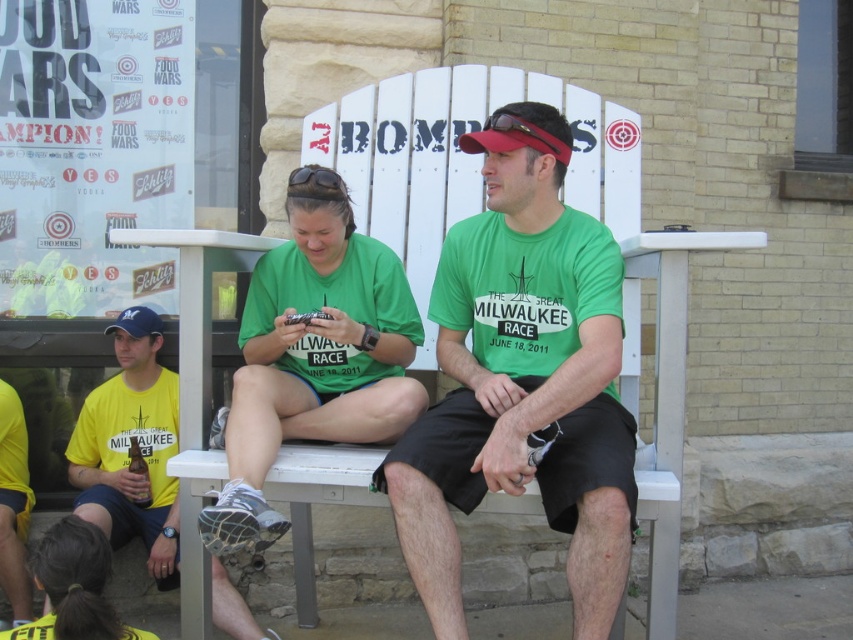
Question: Can you confirm if green cotton shirt at center is thinner than yellow matte shirt at left?

Choices:
 (A) no
 (B) yes

Answer: (B)

Question: Which object appears farthest from the camera in this image?

Choices:
 (A) green cotton shirt at center
 (B) yellow matte shirt at left

Answer: (B)

Question: Is green cotton shirt at center to the right of yellow matte shirt at left from the viewer's perspective?

Choices:
 (A) no
 (B) yes

Answer: (B)

Question: Which object is closer to the camera taking this photo?

Choices:
 (A) green cotton shirt at center
 (B) yellow matte shirt at left

Answer: (A)

Question: Can you confirm if green cotton shirt at center is positioned below yellow matte shirt at left?

Choices:
 (A) no
 (B) yes

Answer: (A)